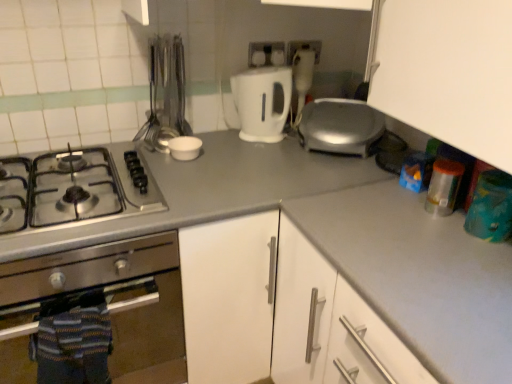
Where is `free space in front of metallic utensils at upper left`? free space in front of metallic utensils at upper left is located at coordinates (170, 162).